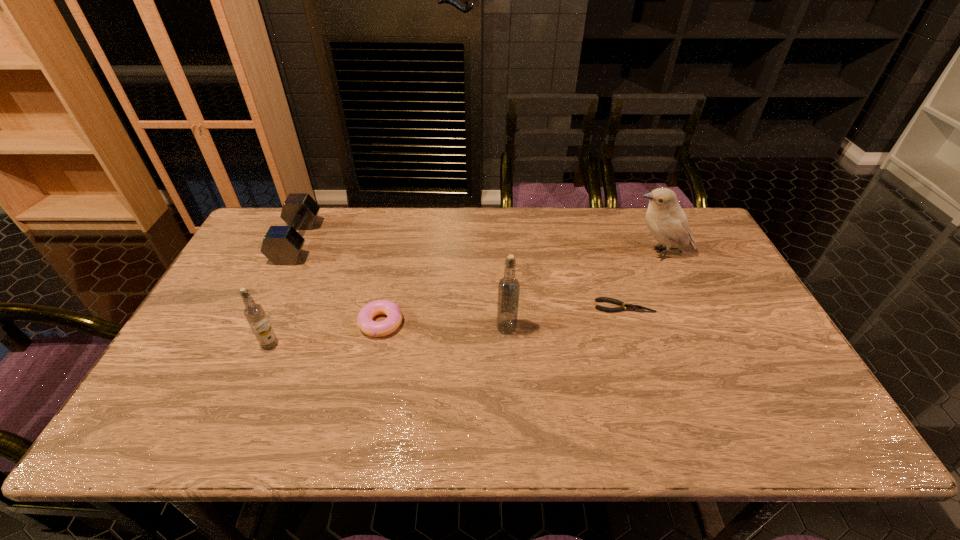
Find the location of a particular element. unoccupied area between the nearer vodka and the bird is located at coordinates (465, 299).

Locate an element on the screen. This screenshot has width=960, height=540. vacant space that is in between the bird and the dumbbell is located at coordinates (478, 248).

Where is `empty space that is in between the bird and the third shortest object`? This screenshot has width=960, height=540. empty space that is in between the bird and the third shortest object is located at coordinates (478, 248).

Find the location of `free space that is in between the right vodka and the shortest object`. free space that is in between the right vodka and the shortest object is located at coordinates (565, 317).

Identify the location of vacant area that lies between the dumbbell and the farther vodka. (401, 285).

I want to click on unoccupied area between the third shortest object and the bird, so click(x=478, y=248).

Identify which object is the second closest to the doughnut. Please provide its 2D coordinates. Your answer should be formatted as a tuple, i.e. [(x, y)], where the tuple contains the x and y coordinates of a point satisfying the conditions above.

[(508, 287)]

Find the location of a particular element. The height and width of the screenshot is (540, 960). the fifth closest object to the fifth tallest object is located at coordinates (666, 220).

At what (x,y) coordinates should I click in order to perform the action: click on vacant space that satisfies the following two spatial constraints: 1. at the beak of the bird; 2. on the front side of the shortest object. Please return your answer as a coordinate pair (x, y). The width and height of the screenshot is (960, 540). Looking at the image, I should click on (684, 306).

Identify the location of vacant region that satisfies the following two spatial constraints: 1. on the label of the third object from right to left; 2. on the label of the left vodka. (508, 345).